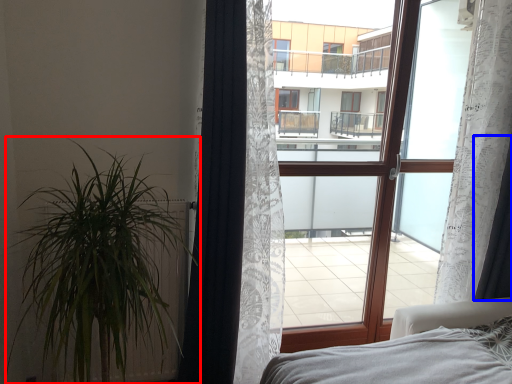
Question: Which object is closer to the camera taking this photo, houseplant (highlighted by a red box) or curtain (highlighted by a blue box)?

Choices:
 (A) houseplant
 (B) curtain

Answer: (A)